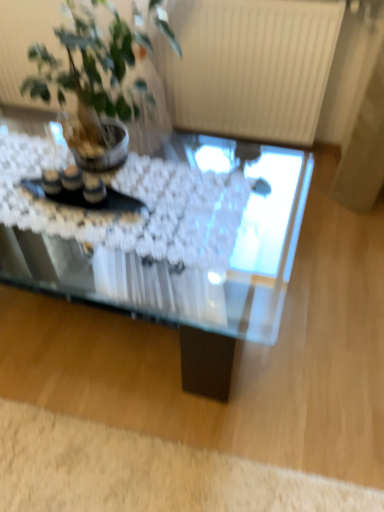
I want to click on vacant point above transparent glass coffee table at center (from a real-world perspective), so click(x=128, y=196).